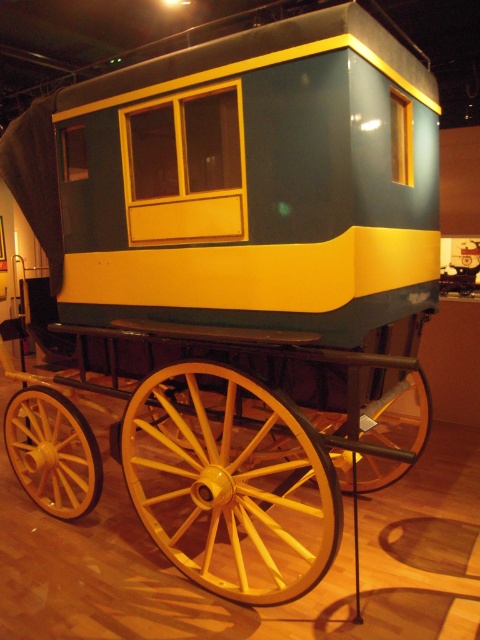
From the picture: Who is more forward, [158,520] or [24,465]?

Point [158,520] is in front.

Which is below, yellow wooden wagon wheel at lower center or yellow wood/woven wheel at lower left?

yellow wood/woven wheel at lower left

Is point (216, 424) positioned before point (79, 424)?

No, it is behind (79, 424).

Where is `yellow wooden wagon wheel at lower center`? The image size is (480, 640). yellow wooden wagon wheel at lower center is located at coordinates (230, 483).

Measure the distance between yellow wood wagon wheel at center and camera.

yellow wood wagon wheel at center is 2.20 meters from camera.

Does yellow wood wagon wheel at center have a smaller size compared to yellow wood/wooden wheel at lower center?

No, yellow wood wagon wheel at center is not smaller than yellow wood/wooden wheel at lower center.

Is point (149, 326) positioned in front of point (361, 490)?

Yes, point (149, 326) is closer to viewer.

This screenshot has width=480, height=640. I want to click on yellow wood wagon wheel at center, so click(x=227, y=445).

Which is in front, point (275, 467) or point (408, 465)?

Point (275, 467)

Does yellow wooden wagon wheel at lower center have a lesser width compared to yellow wood/wooden wheel at lower center?

Incorrect, yellow wooden wagon wheel at lower center's width is not less than yellow wood/wooden wheel at lower center's.

The height and width of the screenshot is (640, 480). Find the location of `yellow wooden wagon wheel at lower center`. yellow wooden wagon wheel at lower center is located at coordinates (230, 483).